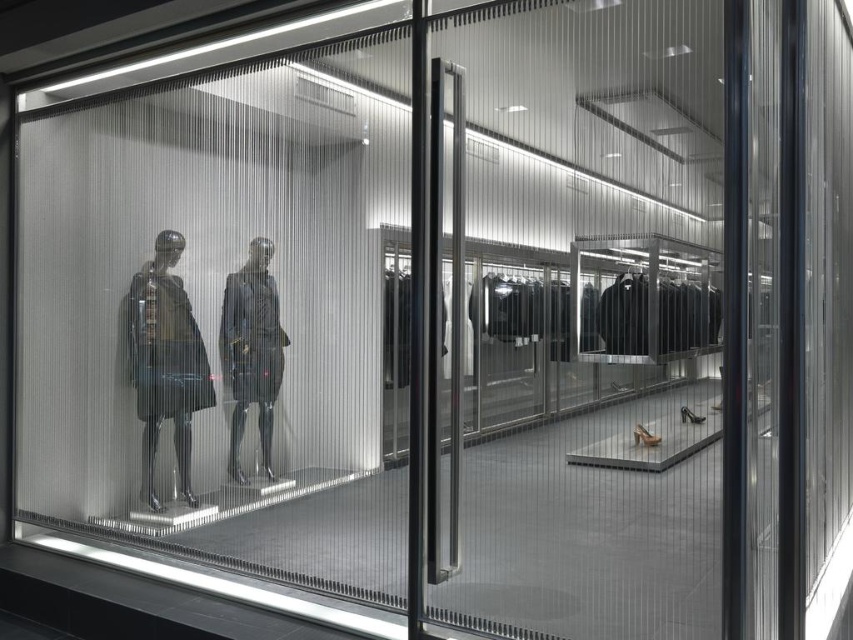
Which is more to the left, transparent plastic mannequins at left or matte black suit at center?

From the viewer's perspective, transparent plastic mannequins at left appears more on the left side.

Can you confirm if transparent plastic mannequins at left is positioned to the right of matte black suit at center?

In fact, transparent plastic mannequins at left is to the left of matte black suit at center.

Is point (386, 38) less distant than point (283, 346)?

That is True.

This screenshot has height=640, width=853. Find the location of `transparent plastic mannequins at left`. transparent plastic mannequins at left is located at coordinates (218, 324).

Is point (466, 496) closer to viewer compared to point (244, 476)?

Yes.

Is transparent plastic door at center to the right of matte black suit at center from the viewer's perspective?

Correct, you'll find transparent plastic door at center to the right of matte black suit at center.

Image resolution: width=853 pixels, height=640 pixels. What are the coordinates of `transparent plastic door at center` in the screenshot? It's located at (578, 323).

How far apart are matte black dress at left and matte black suit at center?

The distance of matte black dress at left from matte black suit at center is 14.63 inches.

Who is taller, matte black dress at left or matte black suit at center?

Standing taller between the two is matte black dress at left.

Locate an element on the screen. The width and height of the screenshot is (853, 640). matte black dress at left is located at coordinates (164, 362).